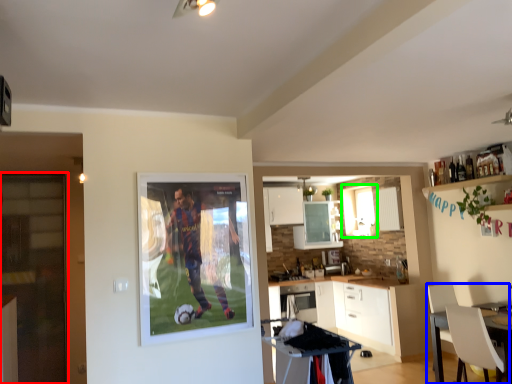
Question: Which object is the closest to the glass door (highlighted by a red box)? Choose among these: chair (highlighted by a blue box) or window (highlighted by a green box).

Choices:
 (A) chair
 (B) window

Answer: (B)